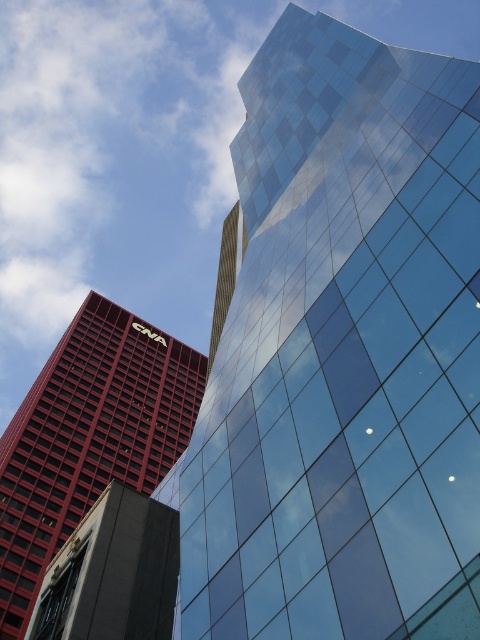
What are the coordinates of `red brick building at left` in the screenshot? It's located at (87, 436).

Which is above, red brick building at left or gold textured tower at center?

gold textured tower at center is above.

Is point (160, 344) positioned in front of point (222, 253)?

No, (160, 344) is behind (222, 253).

Where is `red brick building at left`? Image resolution: width=480 pixels, height=640 pixels. red brick building at left is located at coordinates (87, 436).

Between transparent glass building at upper right and gold textured tower at center, which one is positioned higher?

transparent glass building at upper right

Which is more to the left, transparent glass building at upper right or gold textured tower at center?

gold textured tower at center

The image size is (480, 640). What do you see at coordinates (343, 355) in the screenshot? I see `transparent glass building at upper right` at bounding box center [343, 355].

The image size is (480, 640). I want to click on transparent glass building at upper right, so click(343, 355).

Between transparent glass building at upper right and red brick building at left, which one appears on the left side from the viewer's perspective?

red brick building at left is more to the left.

Measure the distance from transparent glass building at upper right to red brick building at left.

61.67 meters

You are a GUI agent. You are given a task and a screenshot of the screen. Output one action in this format:
    pyautogui.click(x=<x>, y=<y>)
    Task: Click on the transparent glass building at upper right
    The height and width of the screenshot is (640, 480).
    Given the screenshot: What is the action you would take?
    (343, 355)